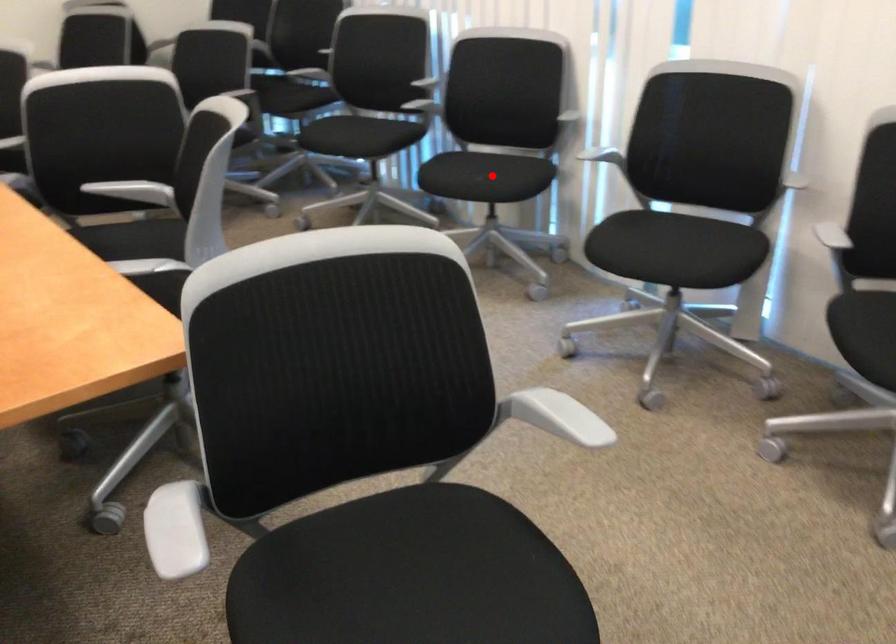
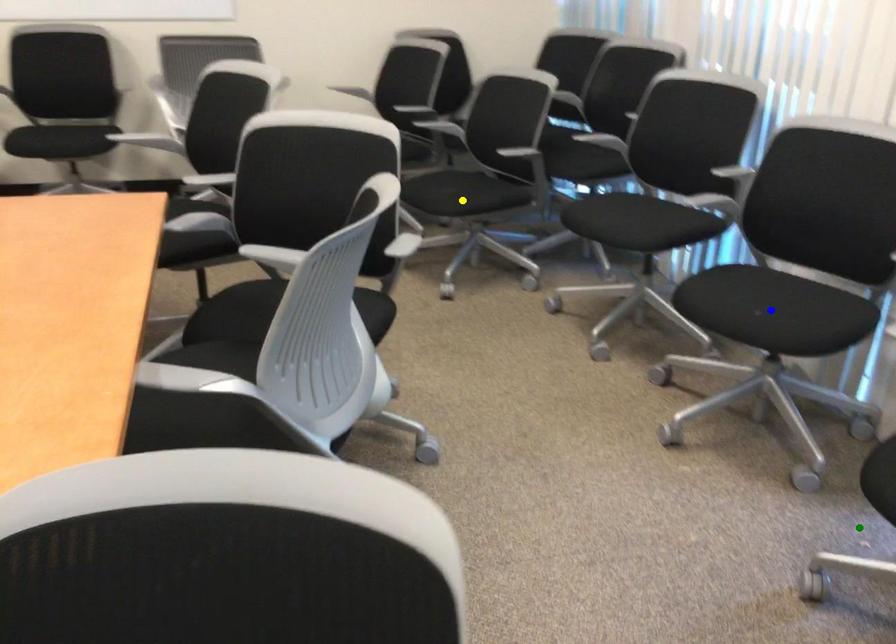
Question: I am providing you with two images of the same scene from different viewpoints. A red point is marked on the first image. You are given multiple points on the second image. In image 2, which mark is for the same physical point as the one in image 1?

Choices:
 (A) yellow point
 (B) green point
 (C) blue point

Answer: (C)